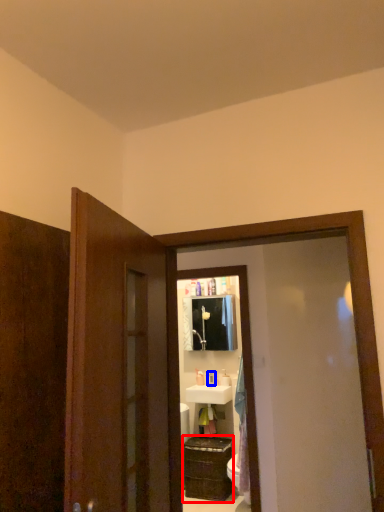
Question: Which of the following is the farthest to the observer, cabinetry (highlighted by a red box) or toiletry (highlighted by a blue box)?

Choices:
 (A) cabinetry
 (B) toiletry

Answer: (B)